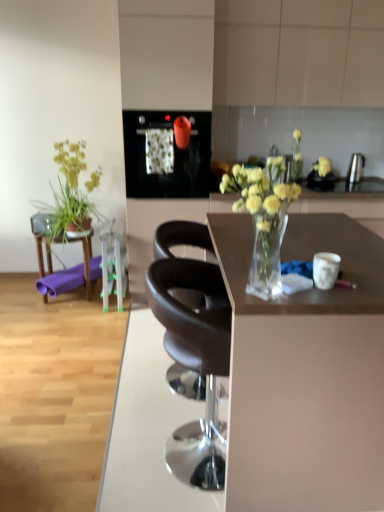
Question: Is satin silver kettle at upper right, which is the 1th appliance from back to front, located outside purple rubber mat at left?

Choices:
 (A) yes
 (B) no

Answer: (A)

Question: From a real-world perspective, is satin silver kettle at upper right, which is counted as the second appliance, starting from the left, located higher than purple rubber mat at left?

Choices:
 (A) yes
 (B) no

Answer: (A)

Question: Is satin silver kettle at upper right, arranged as the second appliance when viewed from the front, beside purple rubber mat at left?

Choices:
 (A) no
 (B) yes

Answer: (A)

Question: Is satin silver kettle at upper right, arranged as the second appliance when viewed from the front, looking in the opposite direction of purple rubber mat at left?

Choices:
 (A) no
 (B) yes

Answer: (A)

Question: Is satin silver kettle at upper right, arranged as the second appliance when viewed from the front, bigger than purple rubber mat at left?

Choices:
 (A) no
 (B) yes

Answer: (A)

Question: In terms of height, does clear glass vase at center look taller or shorter compared to matte brown chair at center, the first chair viewed from the front?

Choices:
 (A) tall
 (B) short

Answer: (B)

Question: Looking at their shapes, would you say clear glass vase at center is wider or thinner than matte brown chair at center, which is the 2th chair in back-to-front order?

Choices:
 (A) thin
 (B) wide

Answer: (A)

Question: Relative to matte brown chair at center, the first chair viewed from the front, is clear glass vase at center in front or behind?

Choices:
 (A) front
 (B) behind

Answer: (A)

Question: Which is correct: clear glass vase at center is inside matte brown chair at center, which is the 2th chair in back-to-front order, or outside of it?

Choices:
 (A) outside
 (B) inside

Answer: (A)

Question: Looking at the image, does satin silver kettle at upper right, which is the first appliance from right to left, seem bigger or smaller compared to matte brown chair at center, the first chair viewed from the front?

Choices:
 (A) small
 (B) big

Answer: (A)

Question: In the image, is satin silver kettle at upper right, which is the first appliance from right to left, on the left side or the right side of matte brown chair at center, which is the 2th chair in back-to-front order?

Choices:
 (A) right
 (B) left

Answer: (A)

Question: Is satin silver kettle at upper right, which is the first appliance from right to left, taller or shorter than matte brown chair at center, which is the 2th chair in back-to-front order?

Choices:
 (A) tall
 (B) short

Answer: (B)

Question: Is satin silver kettle at upper right, which is counted as the second appliance, starting from the left, wider or thinner than matte brown chair at center, which is the 2th chair in back-to-front order?

Choices:
 (A) wide
 (B) thin

Answer: (B)

Question: Is green leafy plant at left taller or shorter than matte brown desk at center?

Choices:
 (A) short
 (B) tall

Answer: (A)

Question: From a real-world perspective, is green leafy plant at left physically located above or below matte brown desk at center?

Choices:
 (A) above
 (B) below

Answer: (A)